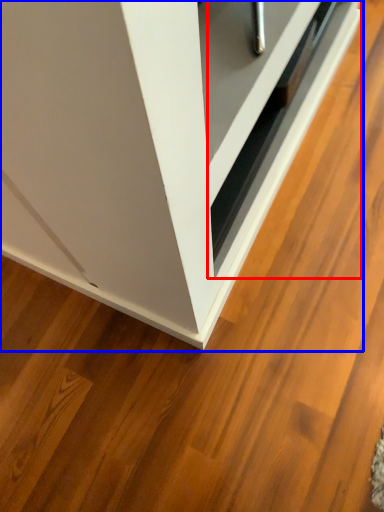
Question: Which of the following is the closest to the observer, drawer (highlighted by a red box) or cabinetry (highlighted by a blue box)?

Choices:
 (A) drawer
 (B) cabinetry

Answer: (B)